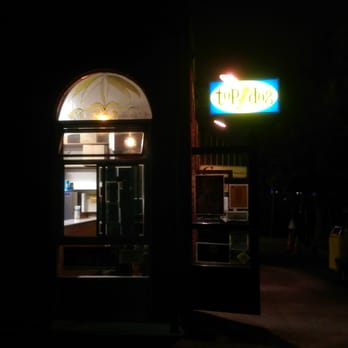
Identify the location of overhead light. (127, 142).